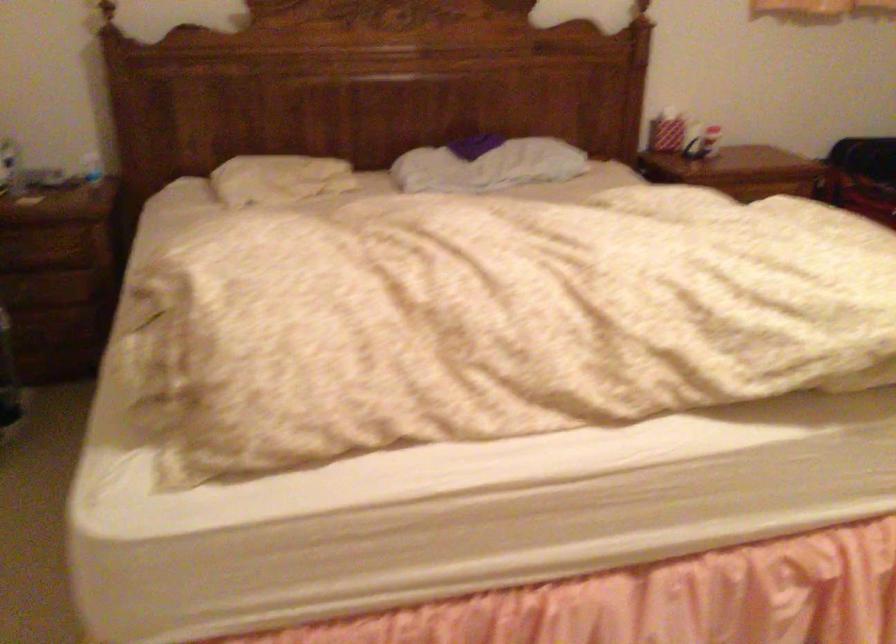
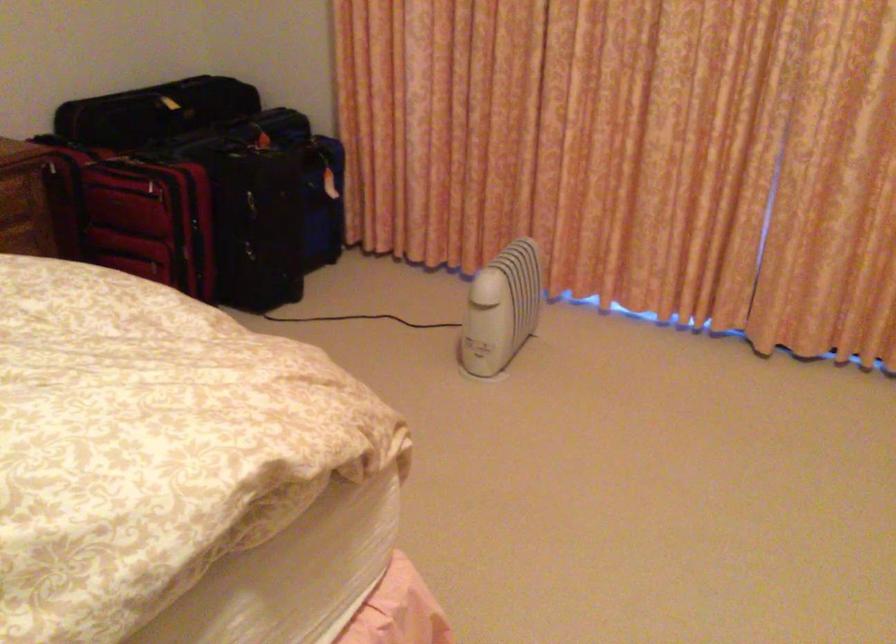
Question: The camera is either moving clockwise (left) or counter-clockwise (right) around the object. The first image is from the beginning of the video and the second image is from the end. Is the camera moving left or right when shooting the video?

Choices:
 (A) Left
 (B) Right

Answer: (A)